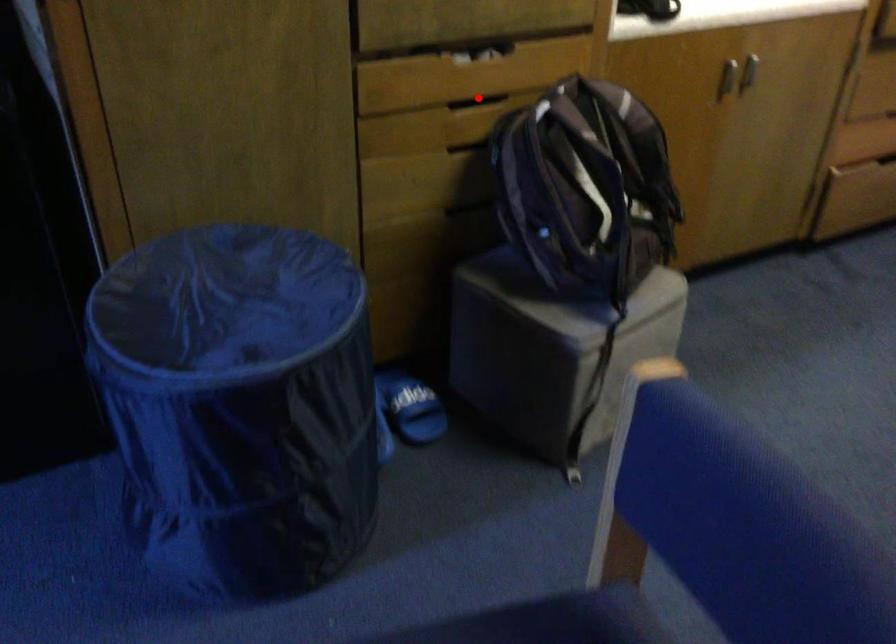
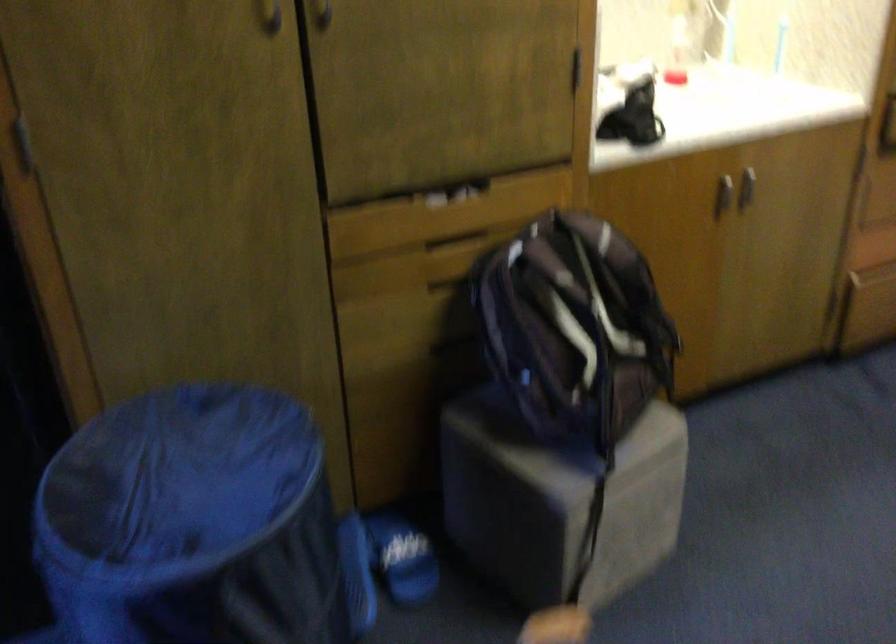
The point at the highlighted location is marked in the first image. Where is the corresponding point in the second image?

(455, 242)